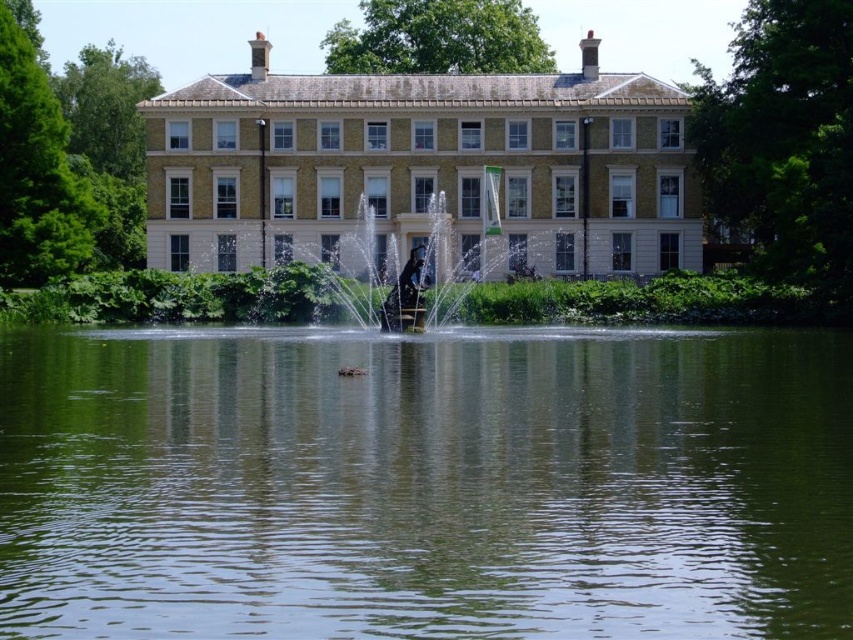
Can you confirm if beige stone mansion at center is thinner than polished bronze statue at center?

No.

The width and height of the screenshot is (853, 640). I want to click on beige stone mansion at center, so click(x=421, y=166).

Is point (582, 40) positioned before point (403, 305)?

No, (582, 40) is further to viewer.

In order to click on beige stone mansion at center in this screenshot , I will do `click(421, 166)`.

Can you confirm if green liquid water at center is shorter than polished bronze statue at center?

Indeed, green liquid water at center has a lesser height compared to polished bronze statue at center.

Is point (213, 364) more distant than point (453, 310)?

No, it is not.

Locate an element on the screen. green liquid water at center is located at coordinates (425, 483).

Can you confirm if green liquid water at center is positioned below beige stone mansion at center?

Yes, green liquid water at center is below beige stone mansion at center.

Is point (682, 364) positioned after point (187, 195)?

No, (682, 364) is closer to viewer.

Locate an element on the screen. green liquid water at center is located at coordinates (425, 483).